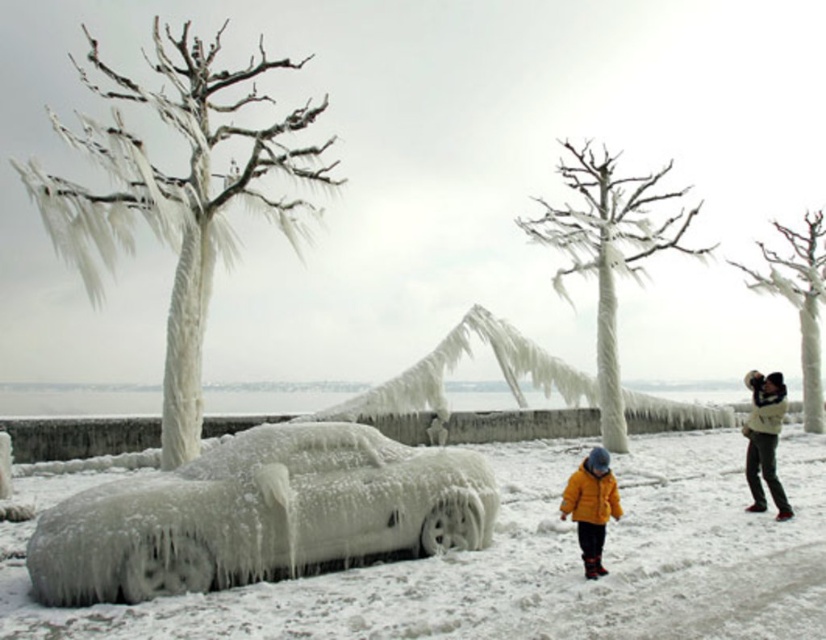
You are a hiker lost in the winter forest and see the white woolen sweater at upper right and the orange fuzzy coat at lower center. Which clothing item is taller?

The white woolen sweater at upper right is taller than the orange fuzzy coat at lower center.

You are a hiker preparing to cross an icy path. You have an orange fuzzy coat at lower center and a white fleece jacket at right available. Which coat should you choose if you want the wider one?

The orange fuzzy coat at lower center is wider than the white fleece jacket at right, so you should choose the orange fuzzy coat at lower center.